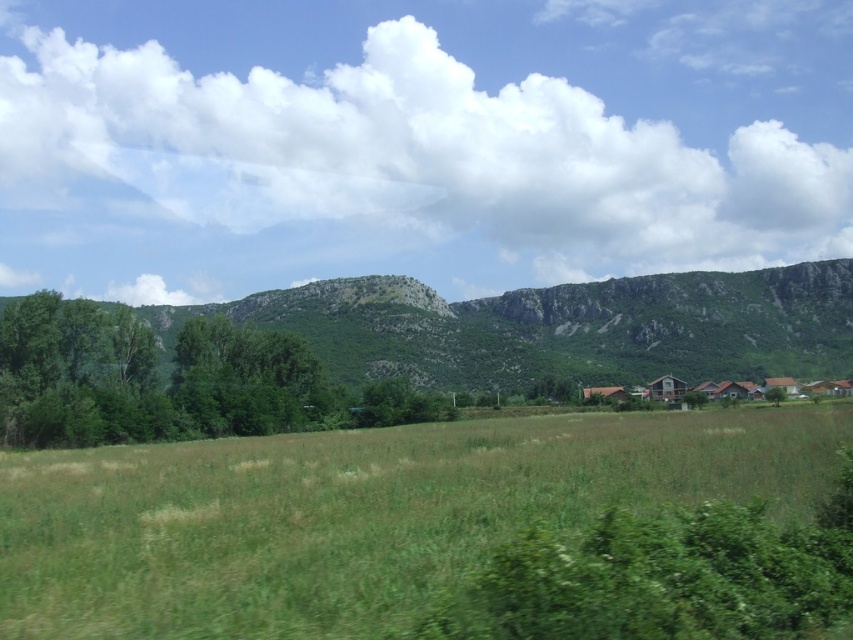
Is point (699, 278) more distant than point (773, 394)?

Yes, it is behind point (773, 394).

Describe the element at coordinates (560, 326) in the screenshot. I see `green rocky mountain at center` at that location.

Describe the element at coordinates (560, 326) in the screenshot. The width and height of the screenshot is (853, 640). I see `green rocky mountain at center` at that location.

Find the location of a particular element. The height and width of the screenshot is (640, 853). green rocky mountain at center is located at coordinates (560, 326).

Can you confirm if green grassy field at center is wider than green leafy tree at center-right?

Yes, green grassy field at center is wider than green leafy tree at center-right.

Does green grassy field at center appear under green leafy tree at center-right?

No, green grassy field at center is not below green leafy tree at center-right.

What do you see at coordinates (361, 513) in the screenshot?
I see `green grassy field at center` at bounding box center [361, 513].

At what (x,y) coordinates should I click in order to perform the action: click on green grassy field at center. Please return your answer as a coordinate pair (x, y). Looking at the image, I should click on (361, 513).

Where is `green grassy field at center`? This screenshot has height=640, width=853. green grassy field at center is located at coordinates (361, 513).

Which is above, green grassy field at center or green rocky mountain at center?

green rocky mountain at center is above.

You are a GUI agent. You are given a task and a screenshot of the screen. Output one action in this format:
    pyautogui.click(x=<x>, y=<y>)
    Task: Click on the green grassy field at center
    This screenshot has width=853, height=640.
    Given the screenshot: What is the action you would take?
    pyautogui.click(x=361, y=513)